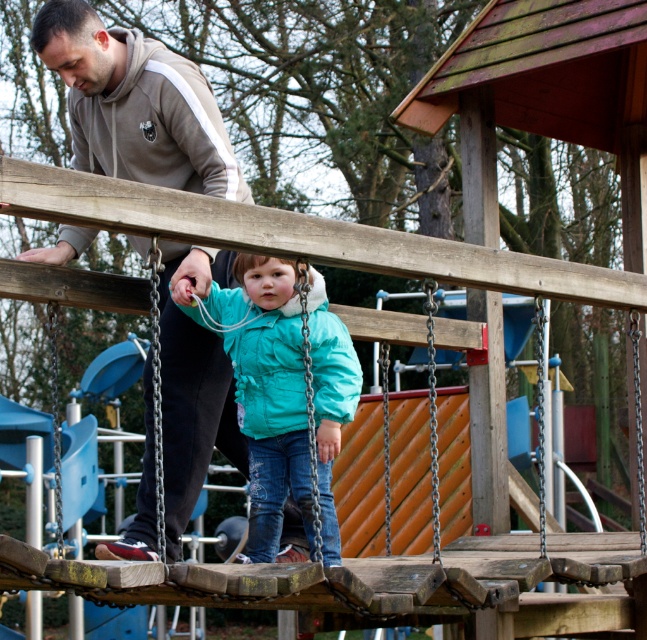
Between gray fleece jacket at upper left and turquoise matte jacket at center, which one is positioned lower?

Positioned lower is turquoise matte jacket at center.

Locate an element on the screen. The width and height of the screenshot is (647, 640). gray fleece jacket at upper left is located at coordinates (135, 104).

Who is more distant from viewer, (210, 332) or (338, 444)?

Point (210, 332)

Identify the location of gray fleece jacket at upper left. pos(135,104).